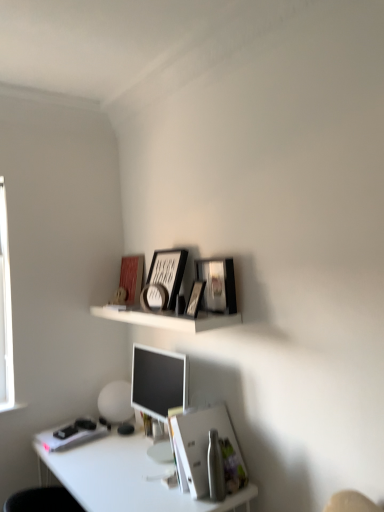
Question: Is matte red book cover at upper center completely or partially outside of matte black picture frame at upper center, acting as the third picture frame starting from the left?

Choices:
 (A) yes
 (B) no

Answer: (A)

Question: Does matte red book cover at upper center contain matte black picture frame at upper center, acting as the third picture frame starting from the left?

Choices:
 (A) no
 (B) yes

Answer: (A)

Question: Is there a large distance between matte red book cover at upper center and matte black picture frame at upper center, acting as the third picture frame starting from the left?

Choices:
 (A) yes
 (B) no

Answer: (B)

Question: Is matte red book cover at upper center closer to camera compared to matte black picture frame at upper center, acting as the third picture frame starting from the left?

Choices:
 (A) yes
 (B) no

Answer: (B)

Question: From the image's perspective, is matte red book cover at upper center on matte black picture frame at upper center, acting as the third picture frame starting from the left?

Choices:
 (A) no
 (B) yes

Answer: (B)

Question: Does matte red book cover at upper center have a greater width compared to matte black picture frame at upper center, acting as the third picture frame starting from the left?

Choices:
 (A) no
 (B) yes

Answer: (A)

Question: Is matte black picture frame at upper center, placed as the second picture frame when sorted from right to left, positioned before metallic silver picture frame at upper center, which is the 4th picture frame in right-to-left order?

Choices:
 (A) no
 (B) yes

Answer: (B)

Question: Is matte black picture frame at upper center, acting as the third picture frame starting from the left, at the left side of metallic silver picture frame at upper center, which appears as the first picture frame when viewed from the left?

Choices:
 (A) yes
 (B) no

Answer: (B)

Question: Is the depth of matte black picture frame at upper center, placed as the second picture frame when sorted from right to left, greater than that of metallic silver picture frame at upper center, which appears as the first picture frame when viewed from the left?

Choices:
 (A) no
 (B) yes

Answer: (A)

Question: Is there a large distance between matte black picture frame at upper center, acting as the third picture frame starting from the left, and metallic silver picture frame at upper center, which is the 4th picture frame in right-to-left order?

Choices:
 (A) no
 (B) yes

Answer: (A)

Question: Is matte black picture frame at upper center, acting as the third picture frame starting from the left, taller than metallic silver picture frame at upper center, which appears as the first picture frame when viewed from the left?

Choices:
 (A) no
 (B) yes

Answer: (B)

Question: From a real-world perspective, is matte black picture frame at upper center, acting as the third picture frame starting from the left, physically below metallic silver picture frame at upper center, which appears as the first picture frame when viewed from the left?

Choices:
 (A) yes
 (B) no

Answer: (B)

Question: Is white paper at lower center wider than white glossy desk at lower left?

Choices:
 (A) no
 (B) yes

Answer: (A)